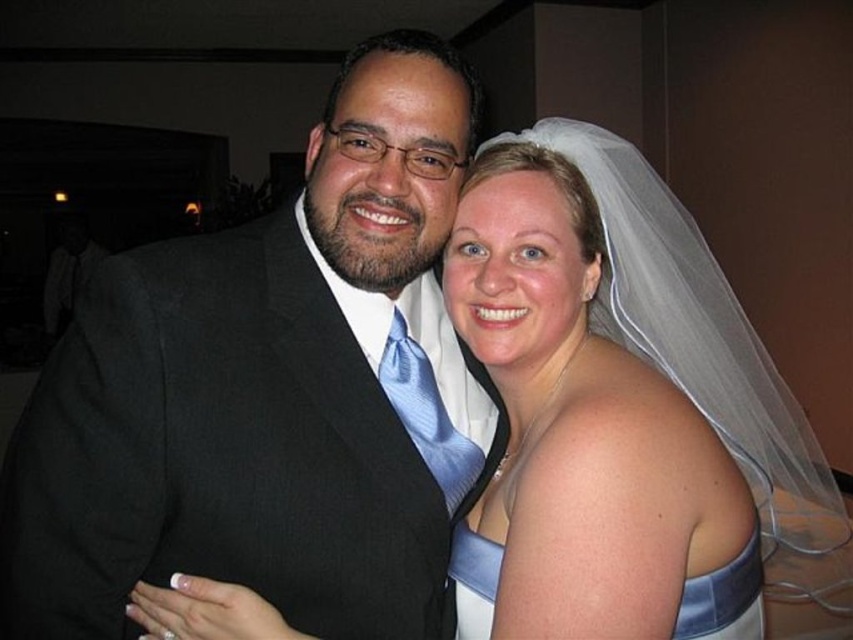
Does white satin dress at center have a lesser width compared to white satin dress at lower right?

No.

Consider the image. Does white satin dress at center have a smaller size compared to white satin dress at lower right?

No.

In the scene shown: Who is more distant from viewer, (x=538, y=134) or (x=724, y=625)?

Point (x=538, y=134)

Locate an element on the screen. white satin dress at center is located at coordinates (585, 422).

Is point (126, 396) less distant than point (448, 570)?

Yes, it is in front of point (448, 570).

Is point (123, 497) positioned behind point (758, 545)?

That is False.

Where is `black suit at center`? The image size is (853, 640). black suit at center is located at coordinates (270, 392).

Who is taller, black suit at center or white satin dress at center?

Standing taller between the two is black suit at center.

Does point (350, 384) come farther from viewer compared to point (500, 246)?

That is False.

Image resolution: width=853 pixels, height=640 pixels. In order to click on black suit at center in this screenshot , I will do `click(270, 392)`.